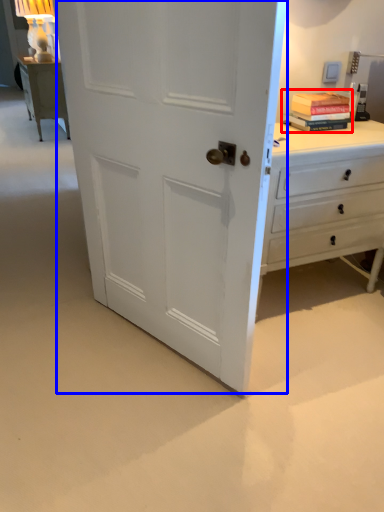
Question: Which point is further to the camera, book (highlighted by a red box) or door (highlighted by a blue box)?

Choices:
 (A) book
 (B) door

Answer: (A)